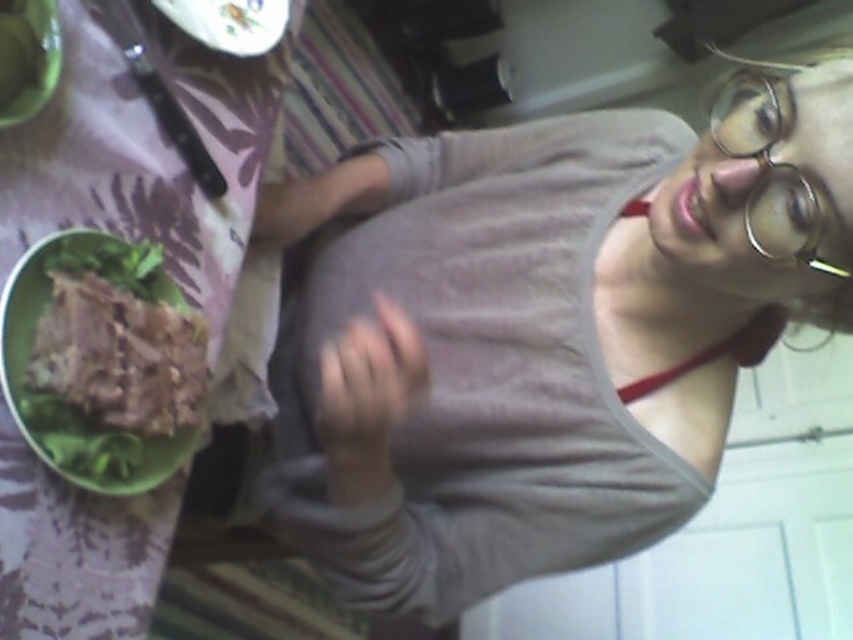
Question: Can you confirm if clear plastic glasses at upper right is positioned above white glossy plate at upper center?

Choices:
 (A) yes
 (B) no

Answer: (B)

Question: Which of these objects is positioned farthest from the gray cotton tank top at center?

Choices:
 (A) white glossy plate at upper center
 (B) green matte bowl at upper left

Answer: (B)

Question: Among these objects, which one is farthest from the camera?

Choices:
 (A) white glossy plate at upper center
 (B) gray cotton tank top at center
 (C) green plastic bowl at upper left

Answer: (A)

Question: Can you confirm if green plastic bowl at upper left is smaller than white glossy plate at upper center?

Choices:
 (A) yes
 (B) no

Answer: (B)

Question: Estimate the real-world distances between objects in this image. Which object is closer to the clear plastic glasses at upper right?

Choices:
 (A) white glossy plate at upper center
 (B) green matte bowl at upper left

Answer: (A)

Question: From the image, what is the correct spatial relationship of green matte bowl at left in relation to clear plastic glasses at upper right?

Choices:
 (A) above
 (B) below

Answer: (B)